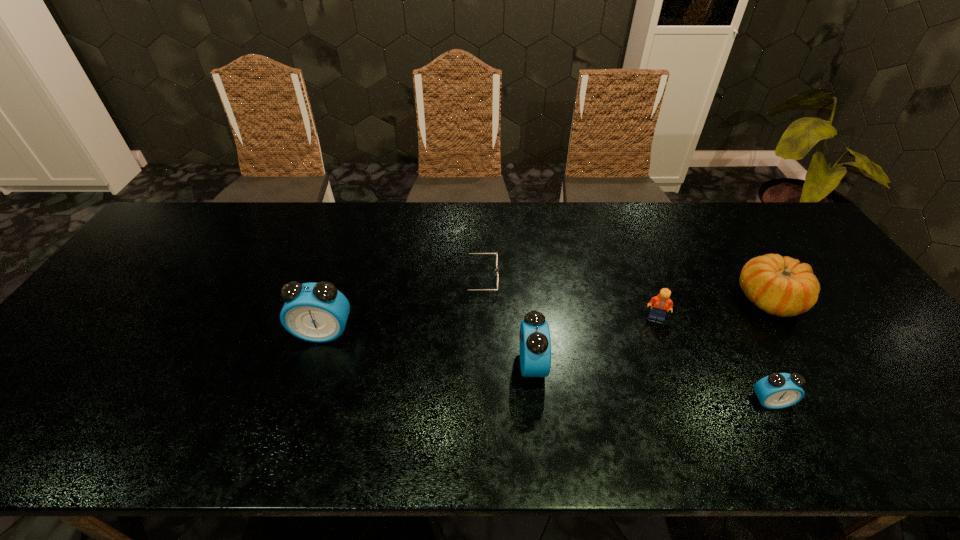
Identify the location of the leftmost object. (317, 312).

Locate an element on the screen. This screenshot has width=960, height=540. the fifth shortest object is located at coordinates (535, 342).

Locate an element on the screen. the second shortest alarm clock is located at coordinates (535, 342).

Where is `the second object from right to left`? the second object from right to left is located at coordinates (778, 390).

Locate an element on the screen. This screenshot has height=540, width=960. the shortest alarm clock is located at coordinates (778, 390).

Where is `Lego`? The width and height of the screenshot is (960, 540). Lego is located at coordinates (661, 302).

Identify the location of the rightmost object. This screenshot has height=540, width=960. (781, 286).

Identify the location of the shortest object. The width and height of the screenshot is (960, 540). (496, 252).

Locate an element on the screen. The width and height of the screenshot is (960, 540). spectacles is located at coordinates (496, 252).

Find the location of a particular element. free space located 0.060m on the face of the leftmost object is located at coordinates (314, 364).